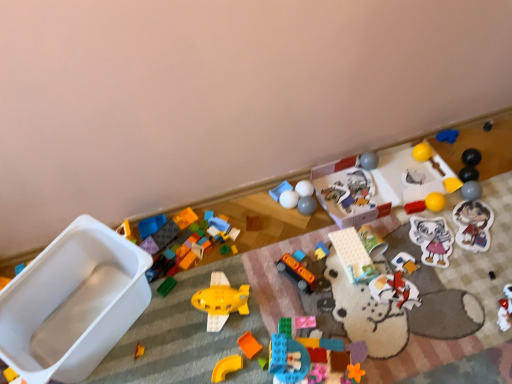
At what (x,y) coordinates should I click in order to perform the action: click on free point to the right of orange plastic block at lower left, which is the third toy in left-to-right order. Please return your answer as a coordinate pair (x, y). The image size is (512, 384). Looking at the image, I should click on click(185, 347).